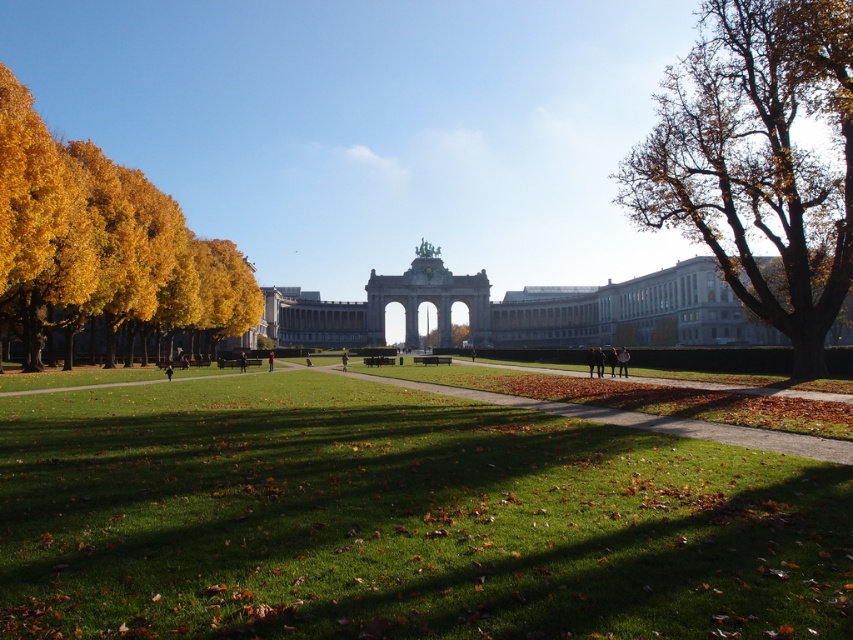
Question: Does yellow leaves at left lie in front of white stone palace at center?

Choices:
 (A) yes
 (B) no

Answer: (A)

Question: Can you confirm if green grassy field at center is positioned above white stone palace at center?

Choices:
 (A) no
 (B) yes

Answer: (A)

Question: Which point is closer to the camera?

Choices:
 (A) green grassy field at center
 (B) green leafy tree at center
 (C) yellow leaves at left

Answer: (A)

Question: Based on their relative distances, which object is farther from the brown leafy tree at right?

Choices:
 (A) green leafy tree at center
 (B) white stone palace at center

Answer: (A)

Question: Among these points, which one is nearest to the camera?

Choices:
 (A) (212, 291)
 (B) (202, 385)
 (C) (456, 333)
 (D) (718, 248)

Answer: (D)

Question: Is yellow leaves at left positioned in front of green leafy tree at center?

Choices:
 (A) yes
 (B) no

Answer: (A)